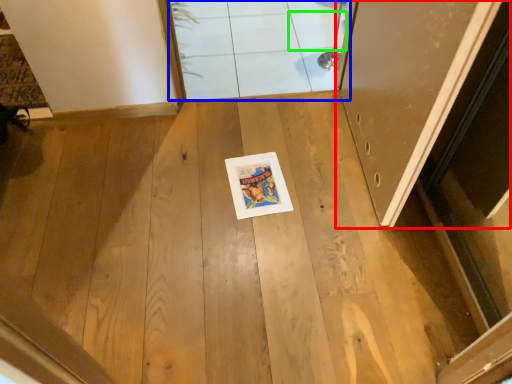
Question: Considering the real-world distances, which object is closest to door (highlighted by a red box)? window (highlighted by a blue box) or tile (highlighted by a green box).

Choices:
 (A) window
 (B) tile

Answer: (A)